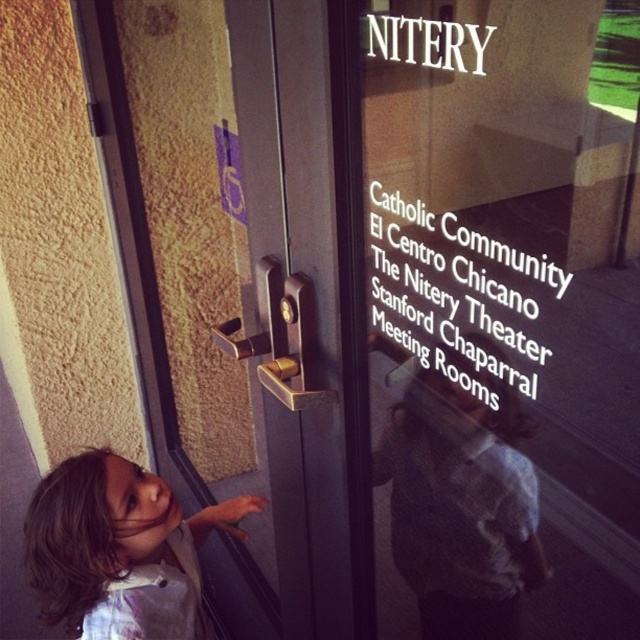
Question: Which point appears farthest from the camera in this image?

Choices:
 (A) (520, 368)
 (B) (54, 486)

Answer: (B)

Question: Does matte gold door handle at lower left have a larger size compared to light brown hair at lower left?

Choices:
 (A) yes
 (B) no

Answer: (A)

Question: Considering the real-world distances, which object is farthest from the matte gold door handle at lower left?

Choices:
 (A) transparent glass door at center
 (B) light brown hair at lower left
 (C) brown hair at lower left

Answer: (B)

Question: Where is transparent glass door at center located in relation to matte gold door handle at lower left in the image?

Choices:
 (A) right
 (B) left

Answer: (A)

Question: Is transparent glass door at center above brown hair at lower left?

Choices:
 (A) yes
 (B) no

Answer: (A)

Question: Which point is farther to the camera?

Choices:
 (A) (134, 67)
 (B) (380, 339)
 (C) (140, 548)
 (D) (426, 301)

Answer: (A)